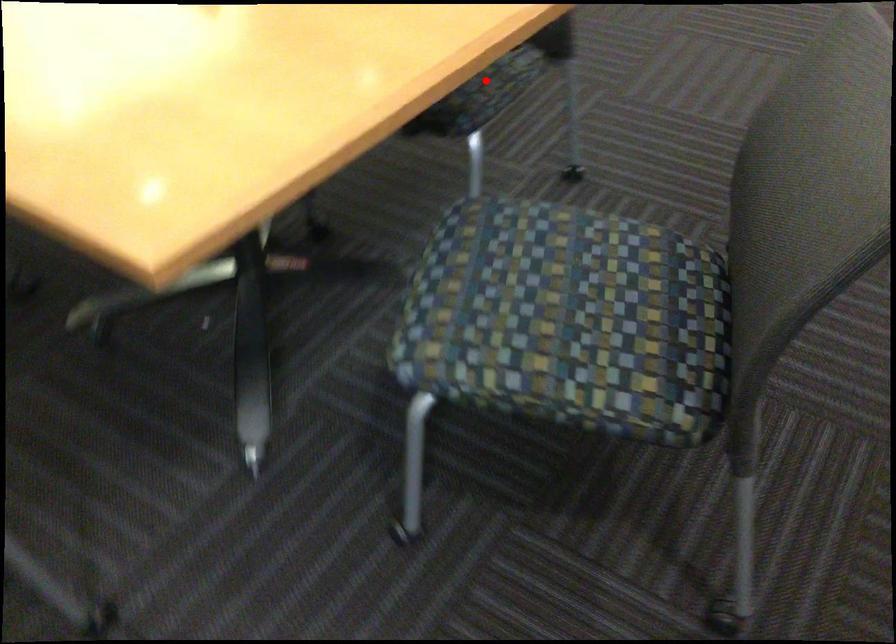
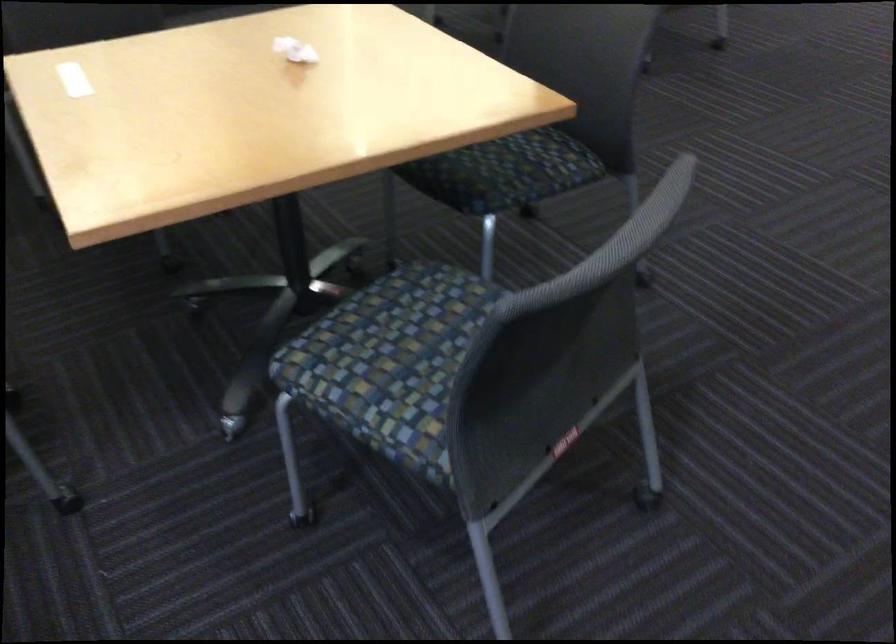
Where in the second image is the point corresponding to the highlighted location from the first image?

(504, 172)